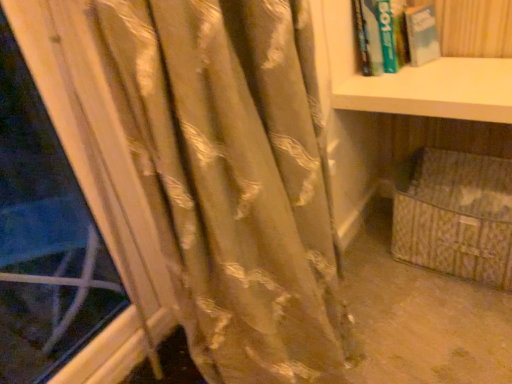
Question: From a real-world perspective, is satin gold curtain at left located higher than beige fabric basket at lower right?

Choices:
 (A) no
 (B) yes

Answer: (B)

Question: From the image's perspective, is satin gold curtain at left located beneath beige fabric basket at lower right?

Choices:
 (A) yes
 (B) no

Answer: (A)

Question: Is the surface of satin gold curtain at left in direct contact with beige fabric basket at lower right?

Choices:
 (A) no
 (B) yes

Answer: (A)

Question: Does satin gold curtain at left have a larger size compared to beige fabric basket at lower right?

Choices:
 (A) yes
 (B) no

Answer: (B)

Question: Considering the relative sizes of satin gold curtain at left and beige fabric basket at lower right in the image provided, is satin gold curtain at left taller than beige fabric basket at lower right?

Choices:
 (A) yes
 (B) no

Answer: (A)

Question: Is satin gold curtain at left oriented towards beige fabric basket at lower right?

Choices:
 (A) yes
 (B) no

Answer: (B)

Question: Considering the relative positions of beige fabric basket at lower right and beige woven basket at lower right in the image provided, is beige fabric basket at lower right to the left of beige woven basket at lower right from the viewer's perspective?

Choices:
 (A) no
 (B) yes

Answer: (B)

Question: Is the position of beige fabric basket at lower right more distant than that of beige woven basket at lower right?

Choices:
 (A) no
 (B) yes

Answer: (A)

Question: Can you see beige fabric basket at lower right touching beige woven basket at lower right?

Choices:
 (A) yes
 (B) no

Answer: (B)

Question: Does beige fabric basket at lower right have a lesser height compared to beige woven basket at lower right?

Choices:
 (A) yes
 (B) no

Answer: (B)

Question: Is beige fabric basket at lower right aimed at beige woven basket at lower right?

Choices:
 (A) no
 (B) yes

Answer: (B)

Question: Is beige fabric basket at lower right wider than beige woven basket at lower right?

Choices:
 (A) yes
 (B) no

Answer: (B)

Question: Can we say beige woven basket at lower right lies outside beige fabric basket at lower right?

Choices:
 (A) yes
 (B) no

Answer: (B)